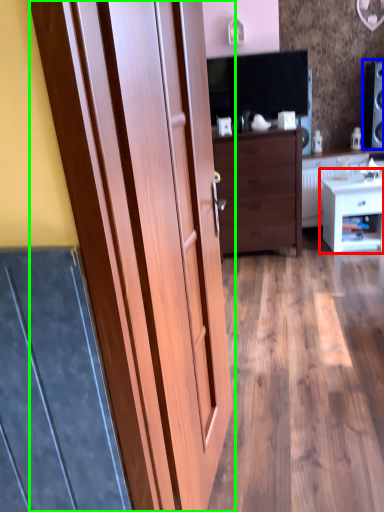
Question: Considering the real-world distances, which object is farthest from nightstand (highlighted by a red box)? speaker (highlighted by a blue box) or door (highlighted by a green box)?

Choices:
 (A) speaker
 (B) door

Answer: (B)